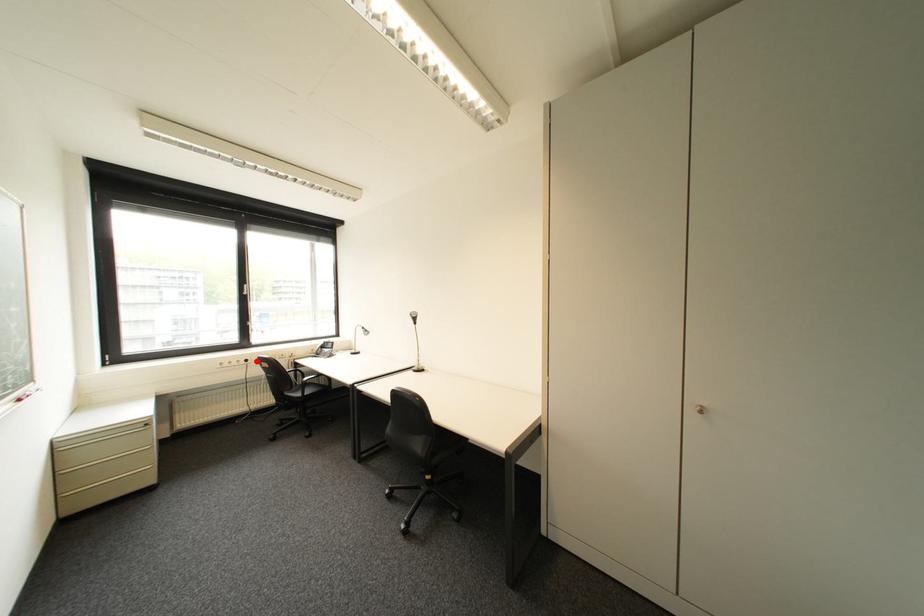
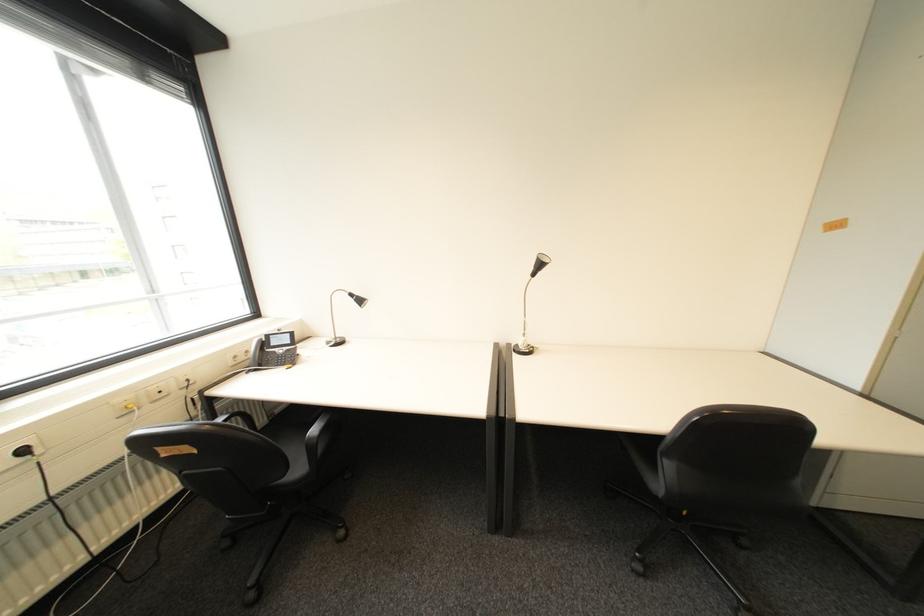
Locate, in the second image, the point that corresponds to the highlighted location in the first image.

(34, 452)